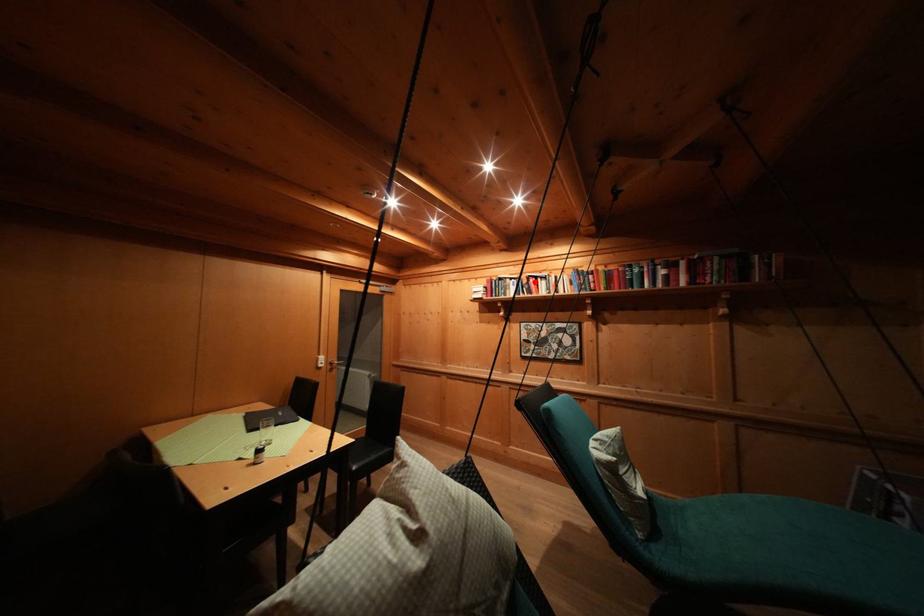
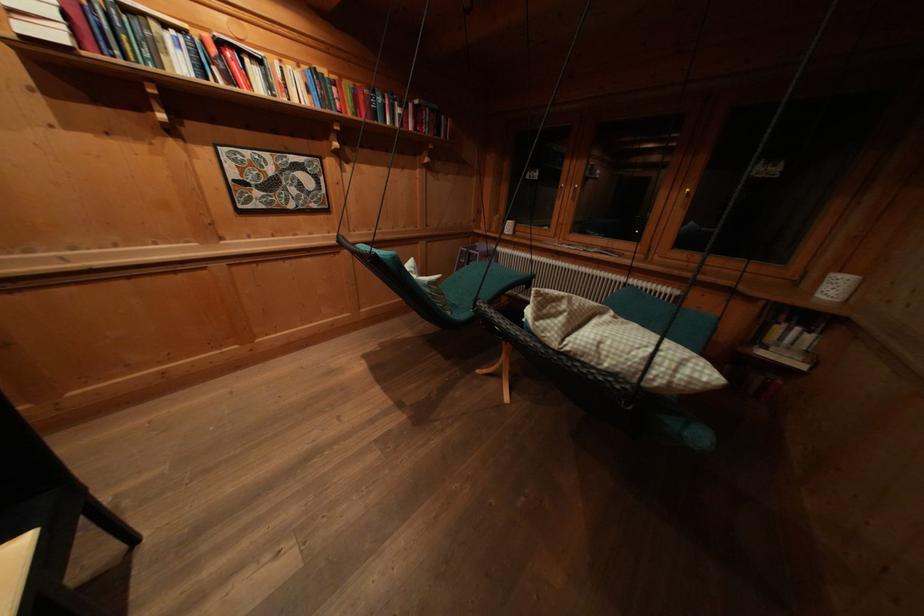
The point at the highlighted location is marked in the first image. Where is the corresponding point in the second image?

(225, 47)